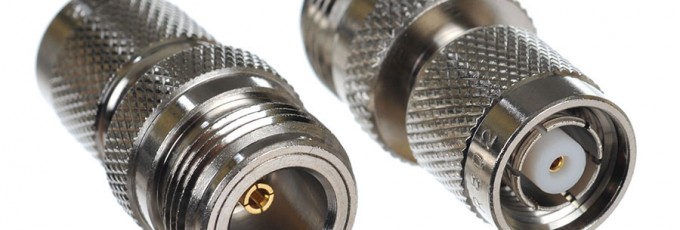
Find the location of a particular element. empty space in the middle is located at coordinates (375, 171).